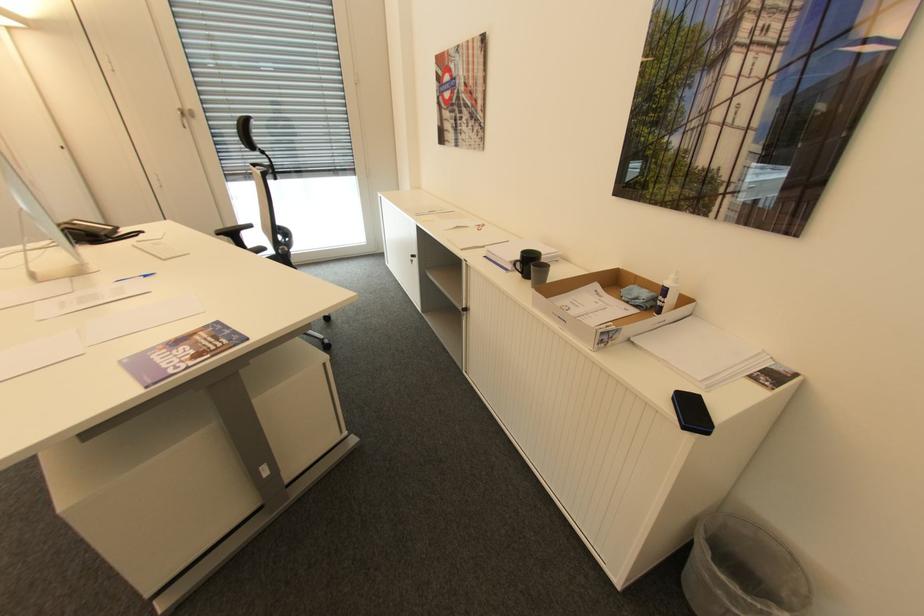
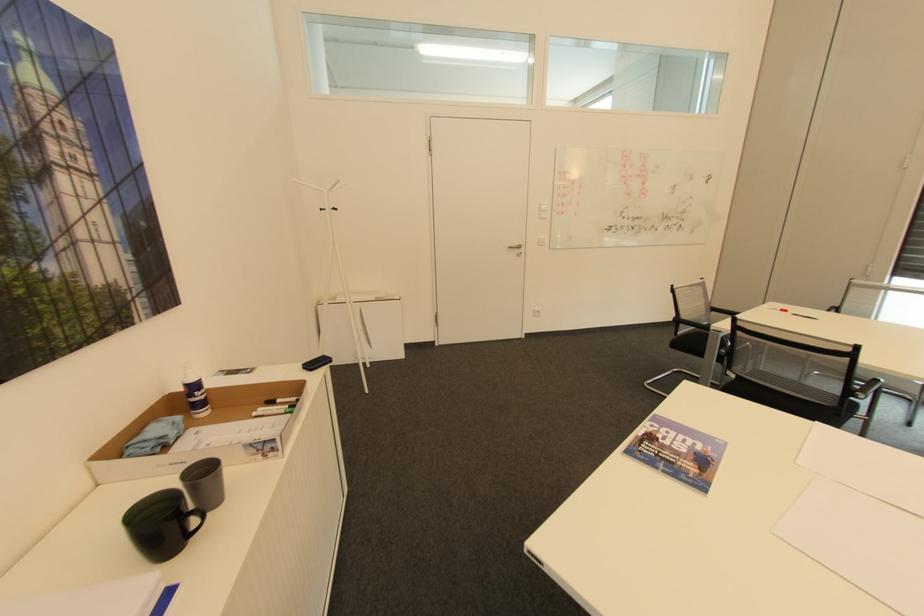
The point at (673, 284) is marked in the first image. Where is the corresponding point in the second image?

(197, 379)